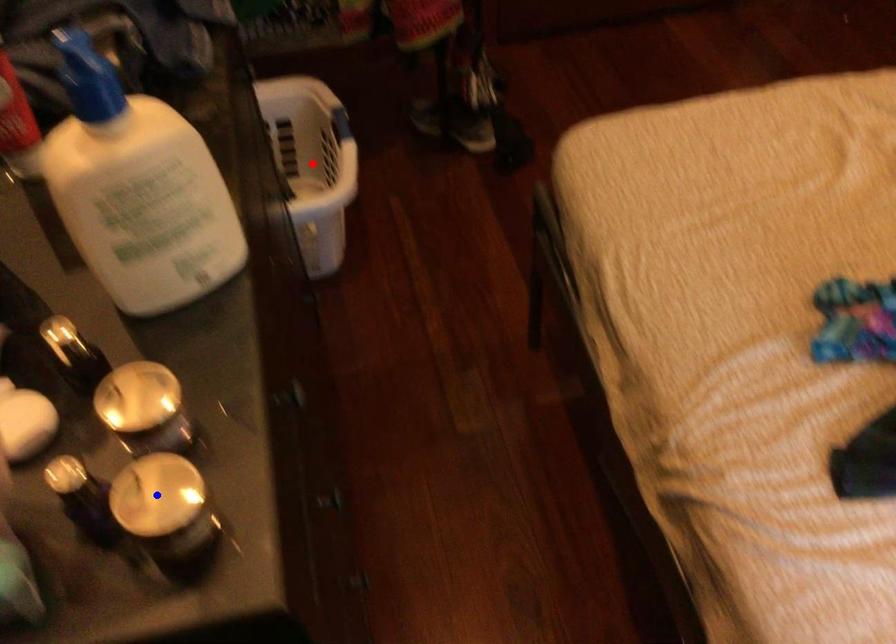
Question: Two points are marked on the image. Which point is closer to the camera?

Choices:
 (A) Blue point is closer.
 (B) Red point is closer.

Answer: (A)